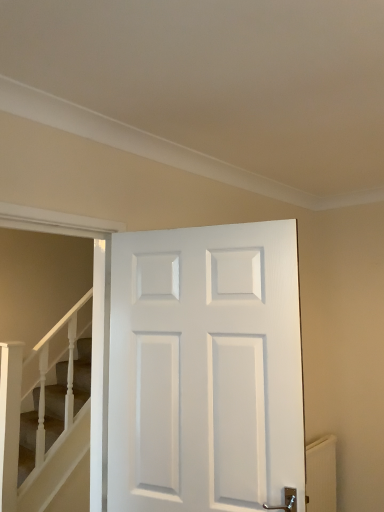
Identify the location of white matte door at center. The height and width of the screenshot is (512, 384). (205, 369).

Consider the image. Which object is closer to the camera taking this photo, white textured radiator at lower right or white matte door at center?

white matte door at center is more forward.

Visually, is white textured radiator at lower right positioned to the left or to the right of white matte door at center?

In the image, white textured radiator at lower right appears on the right side of white matte door at center.

Who is taller, white textured radiator at lower right or white matte door at center?

white matte door at center is taller.

How many degrees apart are the facing directions of white textured radiator at lower right and white matte door at center?

68.6 degrees separate the facing orientations of white textured radiator at lower right and white matte door at center.

Is point (256, 497) closer to viewer compared to point (58, 372)?

Yes, it is.

Between white matte door at center and smooth beige carpet at lower left, which one has larger width?

white matte door at center is wider.

Between white textured radiator at lower right and smooth beige carpet at lower left, which one has less height?

Standing shorter between the two is white textured radiator at lower right.

Is smooth beige carpet at lower left located within white textured radiator at lower right?

No, smooth beige carpet at lower left is not inside white textured radiator at lower right.

Is white textured radiator at lower right oriented away from smooth beige carpet at lower left?

No, white textured radiator at lower right's orientation is not away from smooth beige carpet at lower left.

How many degrees apart are the facing directions of white matte door at center and white textured radiator at lower right?

The angle between the facing direction of white matte door at center and the facing direction of white textured radiator at lower right is 68.6 degrees.

Is white matte door at center situated inside white textured radiator at lower right or outside?

The correct answer is: outside.

Looking at this image, considering the sizes of objects white matte door at center and white textured radiator at lower right in the image provided, who is smaller, white matte door at center or white textured radiator at lower right?

Smaller between the two is white textured radiator at lower right.

The height and width of the screenshot is (512, 384). Identify the location of door lying above the smooth beige carpet at lower left (from the image's perspective). (205, 369).

Is smooth beige carpet at lower left looking in the opposite direction of white matte door at center?

No, smooth beige carpet at lower left is not facing away from white matte door at center.

From the picture: Can you confirm if smooth beige carpet at lower left is smaller than white matte door at center?

Correct, smooth beige carpet at lower left occupies less space than white matte door at center.

How different are the orientations of smooth beige carpet at lower left and white matte door at center in degrees?

70.4 degrees separate the facing orientations of smooth beige carpet at lower left and white matte door at center.

Find the location of a particular element. The height and width of the screenshot is (512, 384). radiator below the smooth beige carpet at lower left (from a real-world perspective) is located at coordinates (321, 474).

Is smooth beige carpet at lower left wider than white textured radiator at lower right?

Incorrect, the width of smooth beige carpet at lower left does not surpass that of white textured radiator at lower right.

The height and width of the screenshot is (512, 384). In order to click on door that is on the left side of white textured radiator at lower right in this screenshot , I will do `click(205, 369)`.

Find the location of a particular element. stairs behind the white matte door at center is located at coordinates (55, 405).

From the image, which object appears to be nearer to white matte door at center, smooth beige carpet at lower left or white textured radiator at lower right?

smooth beige carpet at lower left is closer to white matte door at center.

Looking at the image, which one is located closer to smooth beige carpet at lower left, white matte door at center or white textured radiator at lower right?

white matte door at center is closer to smooth beige carpet at lower left.

Consider the image. Considering their positions, is white matte door at center positioned further to white textured radiator at lower right than smooth beige carpet at lower left?

Among the two, smooth beige carpet at lower left is located further to white textured radiator at lower right.

Which object lies nearer to the anchor point smooth beige carpet at lower left, white textured radiator at lower right or white matte door at center?

Among the two, white matte door at center is located nearer to smooth beige carpet at lower left.

Estimate the real-world distances between objects in this image. Which object is further from white matte door at center, white textured radiator at lower right or smooth beige carpet at lower left?

white textured radiator at lower right is positioned further to the anchor white matte door at center.

Estimate the real-world distances between objects in this image. Which object is further from white textured radiator at lower right, smooth beige carpet at lower left or white matte door at center?

The object further to white textured radiator at lower right is smooth beige carpet at lower left.

The height and width of the screenshot is (512, 384). I want to click on door situated between smooth beige carpet at lower left and white textured radiator at lower right from left to right, so click(205, 369).